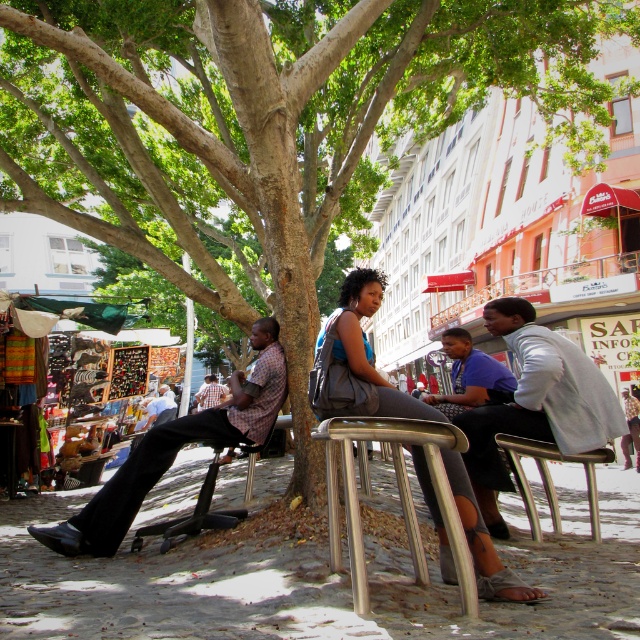
Question: Can you confirm if matte gray tank top at center is positioned to the right of blue shirt at center?

Choices:
 (A) no
 (B) yes

Answer: (A)

Question: Does blue shirt at center have a lesser width compared to metallic silver chair at lower left?

Choices:
 (A) no
 (B) yes

Answer: (A)

Question: Which point is closer to the camera?

Choices:
 (A) matte gray tank top at center
 (B) light gray jacket at center

Answer: (A)

Question: Which object is the farthest from the checkered shirt at center?

Choices:
 (A) metallic silver chair at lower left
 (B) checkered fabric shirt at left
 (C) metallic silver chair at lower right

Answer: (C)

Question: Does light gray jacket at center have a lesser width compared to metallic silver chair at lower left?

Choices:
 (A) yes
 (B) no

Answer: (A)

Question: Which object is closer to the camera taking this photo?

Choices:
 (A) checkered fabric shirt at left
 (B) matte gray tank top at center

Answer: (B)